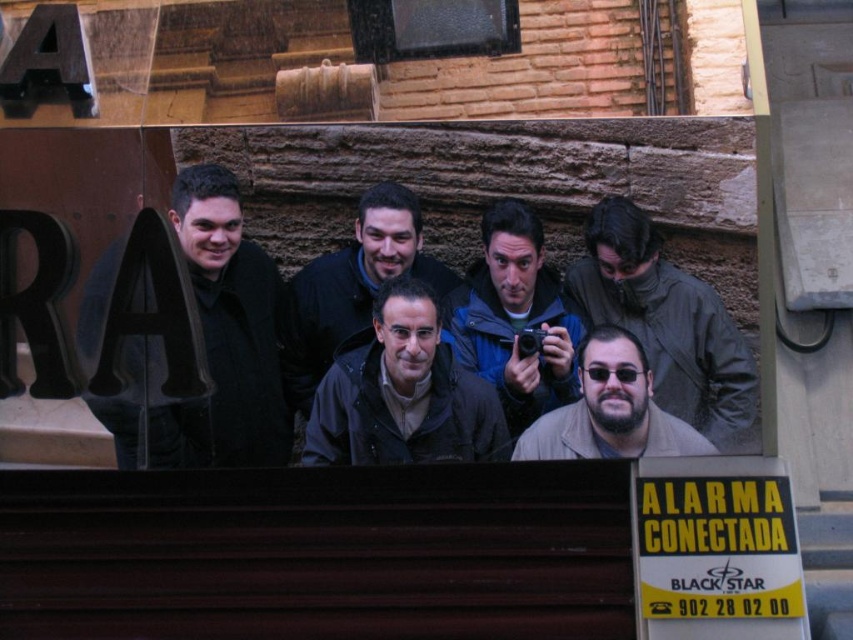
Question: Can you confirm if black matte jacket at left is positioned to the left of yellow paper sign at lower right?

Choices:
 (A) yes
 (B) no

Answer: (A)

Question: Is black matte jacket at left above dark gray jacket at center?

Choices:
 (A) no
 (B) yes

Answer: (B)

Question: Which point is farther from the camera taking this photo?

Choices:
 (A) (711, 451)
 (B) (393, 442)
 (C) (689, 589)

Answer: (A)

Question: Which point appears farthest from the camera in this image?

Choices:
 (A) (653, 586)
 (B) (178, 424)
 (C) (288, 394)

Answer: (C)

Question: Observing the image, what is the correct spatial positioning of dark gray jacket at center in reference to blue jacket at center?

Choices:
 (A) right
 (B) left

Answer: (B)

Question: Which of these objects is positioned farthest from the dark blue jacket at center?

Choices:
 (A) beige textured jacket at center
 (B) dark gray jacket at center
 (C) yellow paper sign at lower right

Answer: (C)